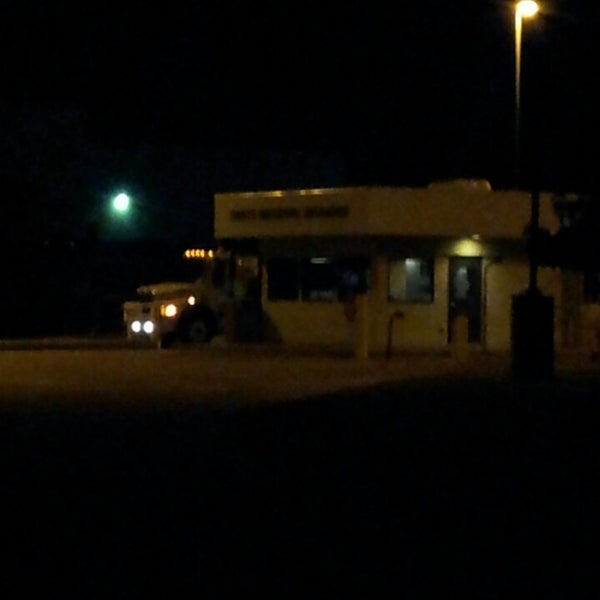
The width and height of the screenshot is (600, 600). I want to click on door, so click(x=470, y=300).